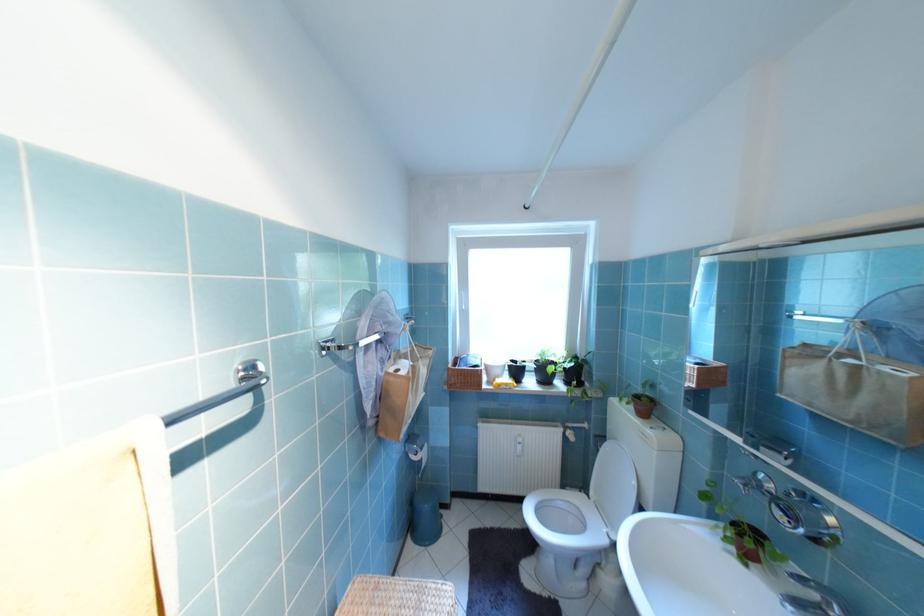
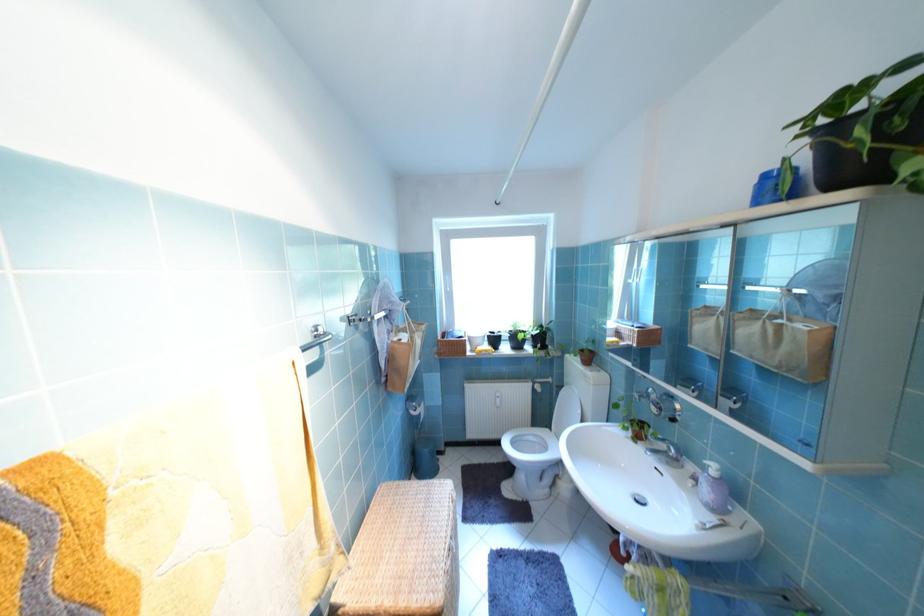
The point at (585, 375) is marked in the first image. Where is the corresponding point in the second image?

(550, 339)